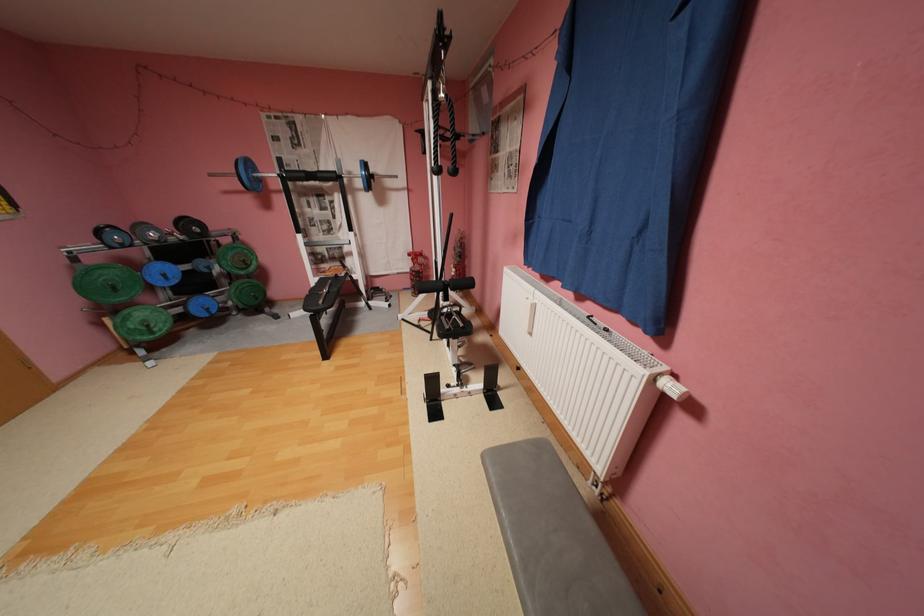
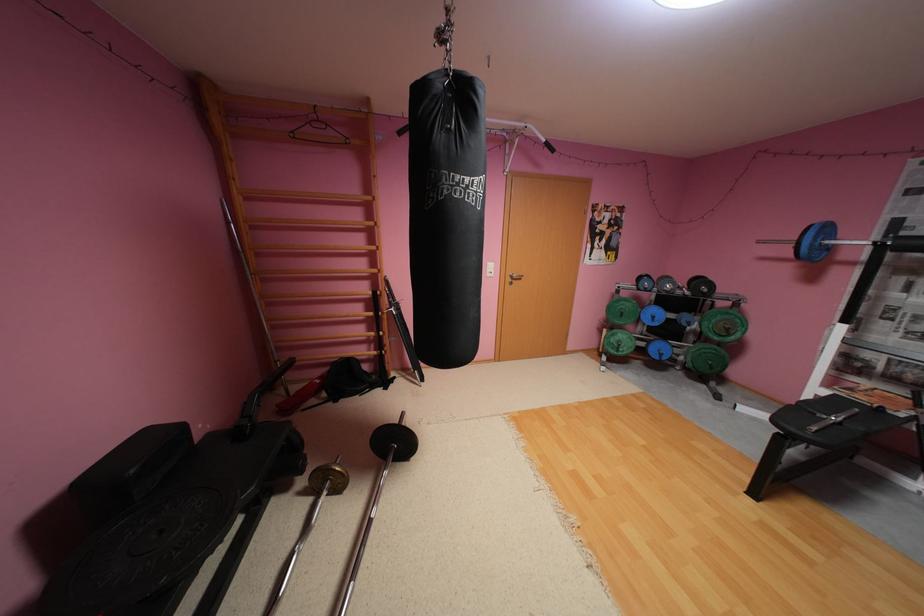
The point at (x=258, y=164) is marked in the first image. Where is the corresponding point in the second image?

(835, 229)